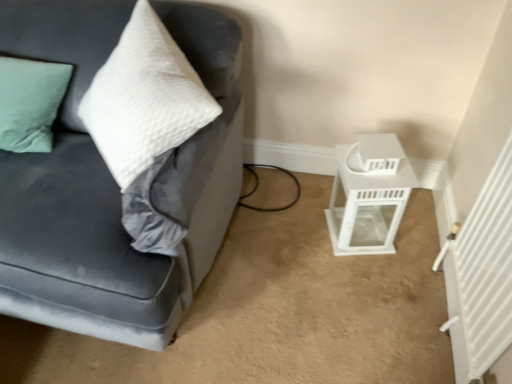
At what (x,y) coordinates should I click in order to perform the action: click on free point above white glossy lantern at lower right (from a real-world perspective). Please return your answer as a coordinate pair (x, y). The image size is (512, 384). Looking at the image, I should click on (365, 170).